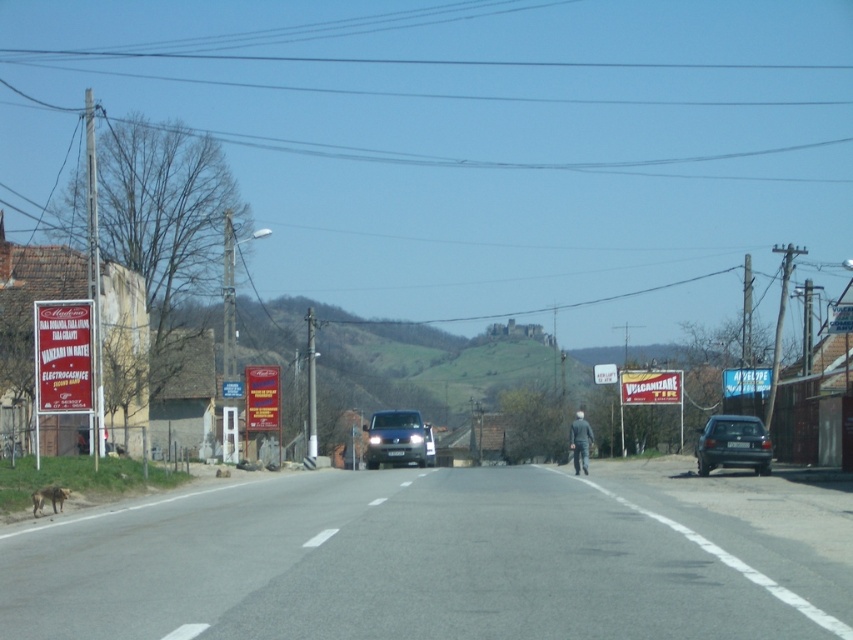
Is dark gray metallic car at right in front of dark gray fabric jacket at center?

No.

Consider the image. Does dark gray metallic car at right have a lesser width compared to dark gray fabric jacket at center?

Indeed, dark gray metallic car at right has a lesser width compared to dark gray fabric jacket at center.

Does point (759, 474) come behind point (572, 456)?

That is False.

Locate an element on the screen. Image resolution: width=853 pixels, height=640 pixels. dark gray metallic car at right is located at coordinates (733, 444).

Between dark gray metallic car at right and brown fur dog at lower left, which one appears on the left side from the viewer's perspective?

brown fur dog at lower left is more to the left.

Which of these two, dark gray metallic car at right or brown fur dog at lower left, stands shorter?

brown fur dog at lower left is shorter.

Who is more forward, (x=705, y=433) or (x=45, y=490)?

Point (x=45, y=490)

Identify the location of dark gray metallic car at right. (733, 444).

Is satin black van at center behind brown fur dog at lower left?

Yes, satin black van at center is further from the viewer.

Who is more forward, [393,449] or [45,486]?

Positioned in front is point [45,486].

At what (x,y) coordinates should I click in order to perform the action: click on satin black van at center. Please return your answer as a coordinate pair (x, y). Image resolution: width=853 pixels, height=640 pixels. Looking at the image, I should click on (398, 440).